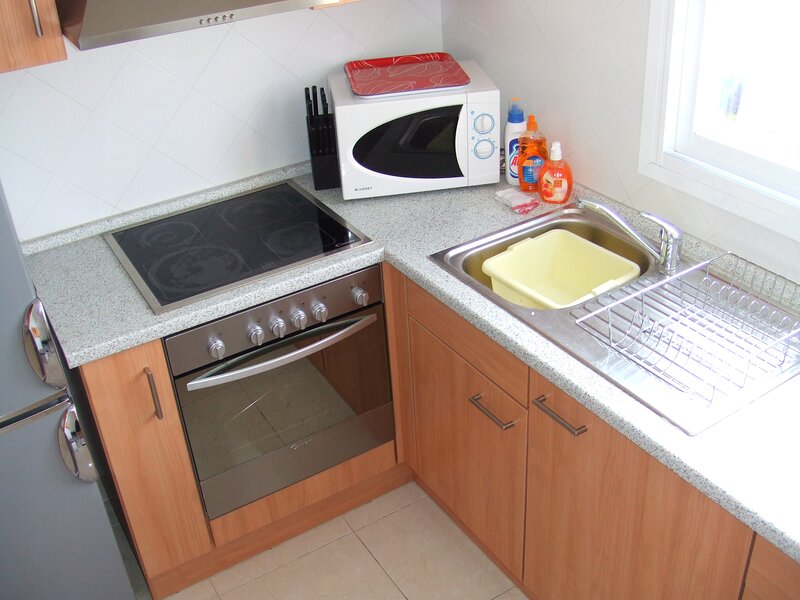
Identify the location of cabinet door 3. (569, 480).